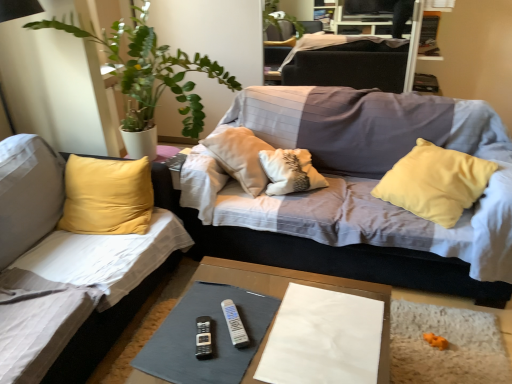
Question: From the image's perspective, is green leafy plant at left located above or below yellow fabric studio couch at left, which appears as the 1th studio couch when viewed from the left?

Choices:
 (A) above
 (B) below

Answer: (A)

Question: Considering the relative positions of green leafy plant at left and yellow fabric studio couch at left, the 2th studio couch viewed from the right, in the image provided, is green leafy plant at left to the left or to the right of yellow fabric studio couch at left, the 2th studio couch viewed from the right,?

Choices:
 (A) left
 (B) right

Answer: (B)

Question: Based on their relative distances, which object is nearer to the white plastic remote at center, which is counted as the second remote, starting from the left?

Choices:
 (A) white paper at center
 (B) black plastic remote at center, the 1th remote in the left-to-right sequence
 (C) yellow fabric studio couch at left, the 2th studio couch viewed from the right
 (D) dark gray fabric couch at upper center
 (E) green leafy plant at left

Answer: (B)

Question: Which of these objects is positioned closest to the textured gray couch at center, which is the first studio couch in right-to-left order?

Choices:
 (A) smooth gray fabric at center
 (B) black plastic remote at center, which is the second remote from right to left
 (C) yellow fabric studio couch at left, the 2th studio couch viewed from the right
 (D) white paper at center
 (E) dark gray fabric couch at upper center

Answer: (A)